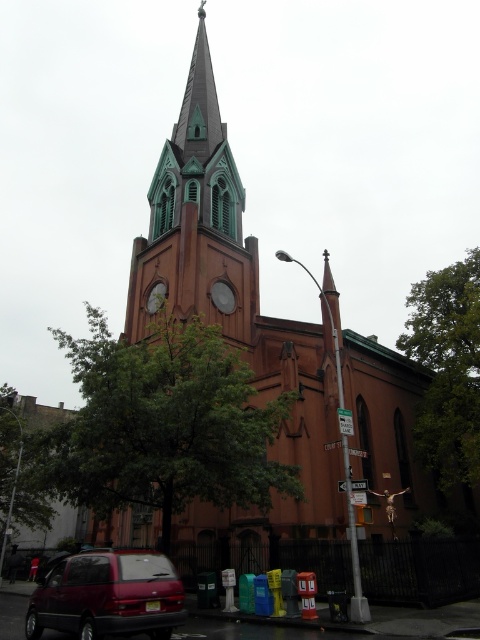
You are standing at the point marked as point (160, 426) in the image. What is the nearest object to you?

The nearest object to you at point (160, 426) is the green leafy tree at center.

You are a pedestrian standing at the sidewalk in front of the church. You notice the green leafy tree at right and the matte red minivan at lower left. Which object takes up more space in the scene?

The green leafy tree at right is larger in size than the matte red minivan at lower left, so it takes up more space in the scene.